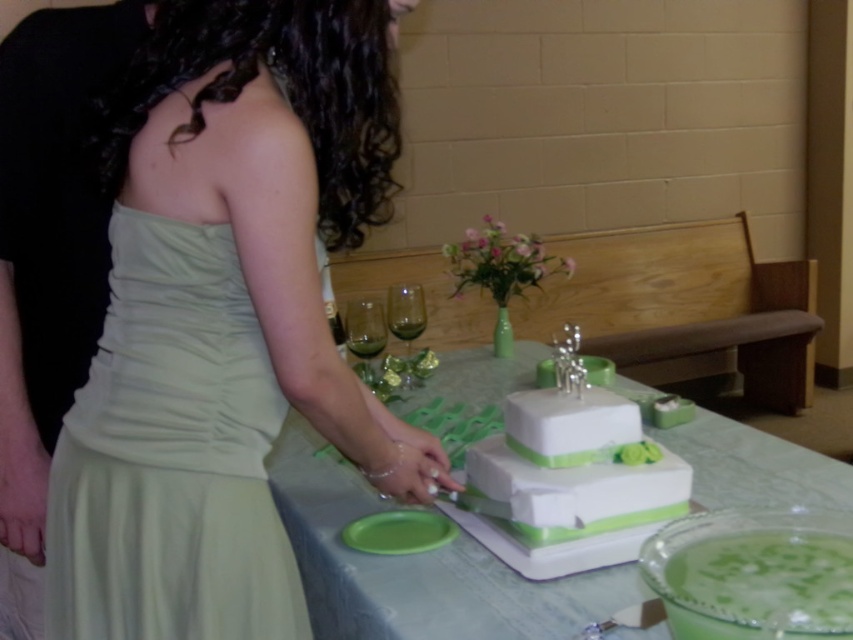
In the scene shown: You are a guest at the wedding reception and want to take a piece of cake. You see the white glossy cake at center and the green frosted cake at center. Which cake is located to the left of the other?

The white glossy cake at center is positioned on the left side of green frosted cake at center.

In the scene shown: You are a guest at the wedding reception and want to grab a drink from the table. The white matte wedding cake at center and the translucent glass wine at center are both in your way. Which object should you move to access the drink?

You should move the translucent glass wine at center because the white matte wedding cake at center is to the right of it, so moving the cake would require more space and might disrupt the cake setup. Alternatively, moving the wine glass would be easier and allow access to the drink.

You are a guest at the wedding reception and want to grab a drink before the toast. The host mentioned that the drink you need is the one above the cake. Which object should you choose between the white matte wedding cake at center and the translucent glass wine at center?

The translucent glass wine at center is above the white matte wedding cake at center, so you should choose the translucent glass wine at center as it is positioned above the cake.